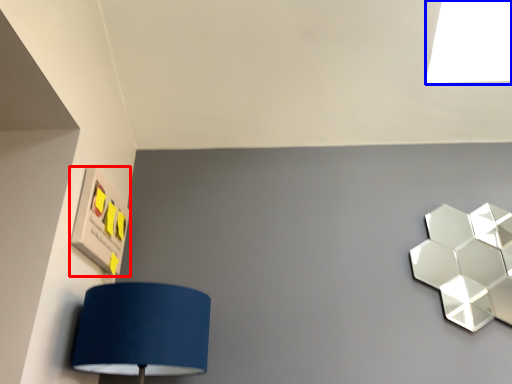
Question: Among these objects, which one is nearest to the camera, square (highlighted by a red box) or light (highlighted by a blue box)?

Choices:
 (A) square
 (B) light

Answer: (A)